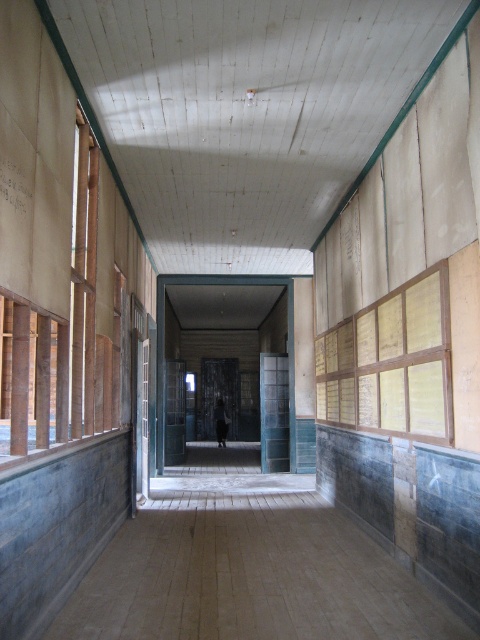
Question: Can you confirm if wooden paneling at right is smaller than white paper at upper left?

Choices:
 (A) no
 (B) yes

Answer: (A)

Question: Among these objects, which one is farthest from the camera?

Choices:
 (A) dark gray fabric at center
 (B) wooden paneling at right

Answer: (A)

Question: Which point is farther to the camera?

Choices:
 (A) white paper at upper left
 (B) dark gray fabric at center

Answer: (B)

Question: Based on their relative distances, which object is nearer to the white paper at upper left?

Choices:
 (A) dark gray fabric at center
 (B) wooden paneling at right

Answer: (B)

Question: Considering the relative positions of wooden paneling at right and white paper at upper left in the image provided, where is wooden paneling at right located with respect to white paper at upper left?

Choices:
 (A) above
 (B) below

Answer: (B)

Question: Does white paper at upper left appear over dark gray fabric at center?

Choices:
 (A) yes
 (B) no

Answer: (A)